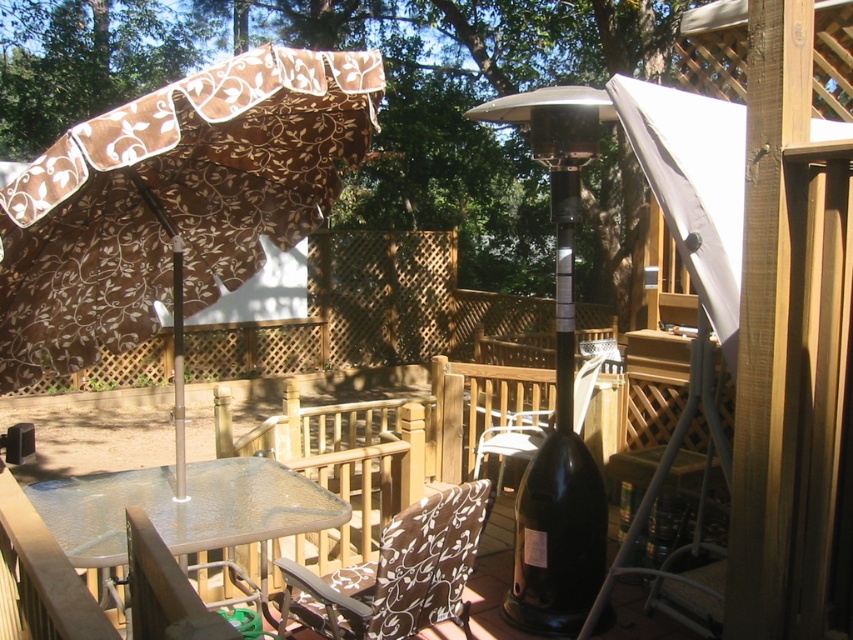
You are sitting at the brown fabric chair at center and want to grab the brown floral fabric umbrella at upper left. Can you reach it without moving from the chair?

The brown floral fabric umbrella at upper left is closer to the viewer than brown fabric chair at center, so you can reach it without moving from the chair.